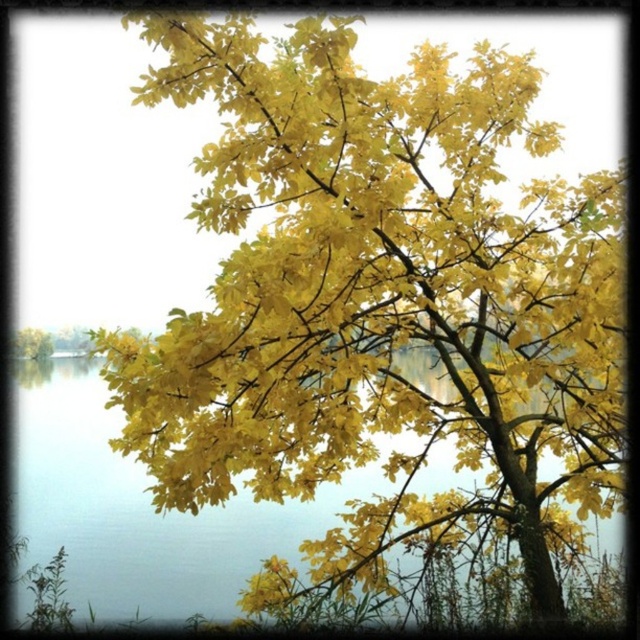
Question: Where is transparent water at center located in relation to yellow matte tree at left in the image?

Choices:
 (A) above
 (B) below

Answer: (B)

Question: Is transparent water at center to the right of yellow matte tree at left from the viewer's perspective?

Choices:
 (A) yes
 (B) no

Answer: (A)

Question: Is transparent water at center bigger than yellow matte tree at left?

Choices:
 (A) yes
 (B) no

Answer: (A)

Question: Which point is closer to the camera?

Choices:
 (A) (29, 480)
 (B) (45, 356)

Answer: (A)

Question: Which point is closer to the camera?

Choices:
 (A) (44, 336)
 (B) (115, 584)

Answer: (B)

Question: Which of the following is the closest to the observer?

Choices:
 (A) (51, 340)
 (B) (44, 468)

Answer: (B)